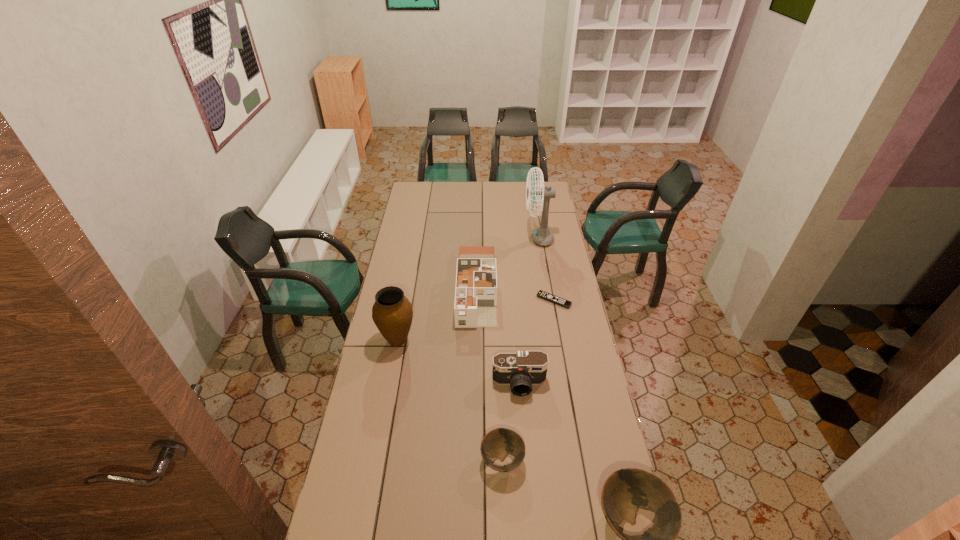
Find the location of a particular element. The image size is (960, 540). free space for a new bowl on the left is located at coordinates (396, 409).